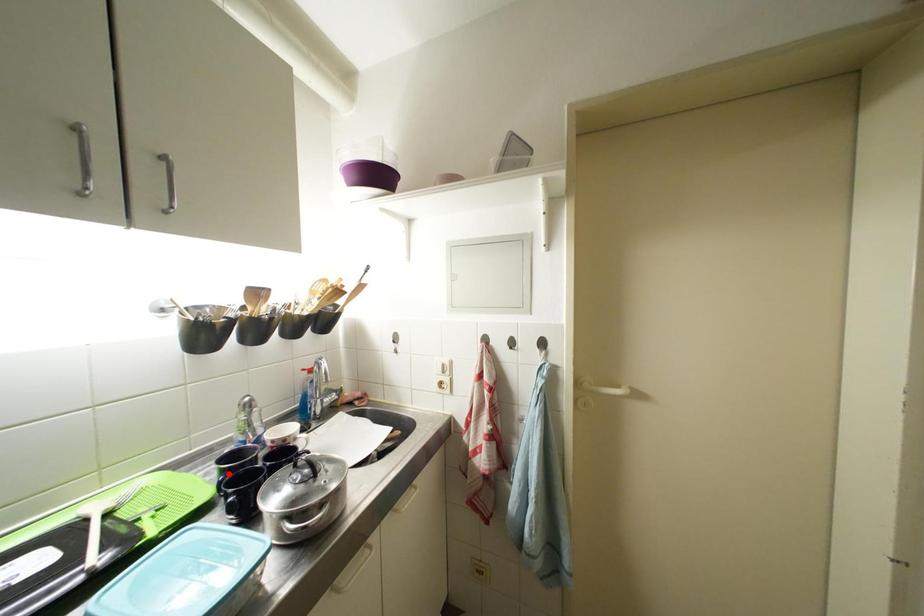
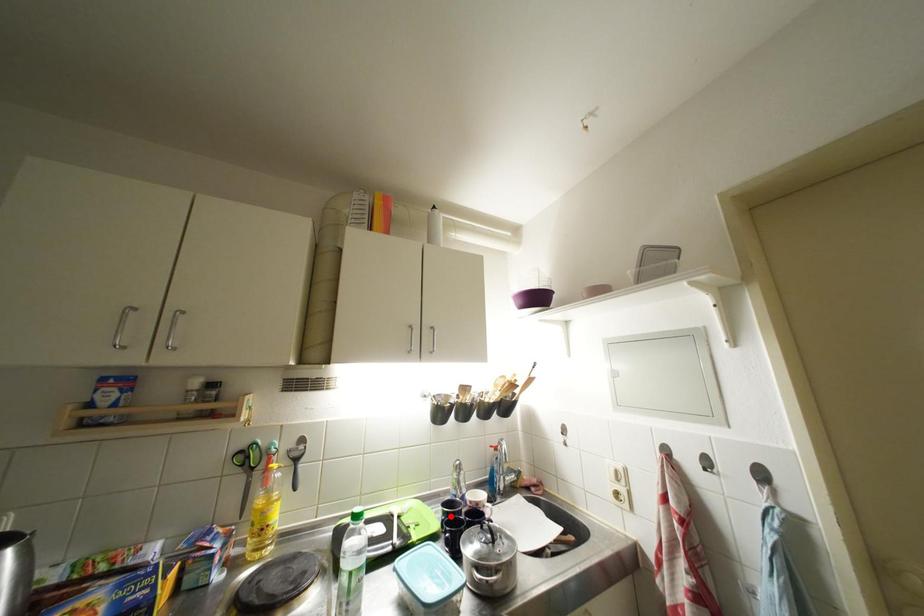
I am providing you with two images of the same scene from different viewpoints. A red point is marked on the first image and another point is marked on the second image. Are the points marked in image1 and image2 representing the same 3D position?

Yes